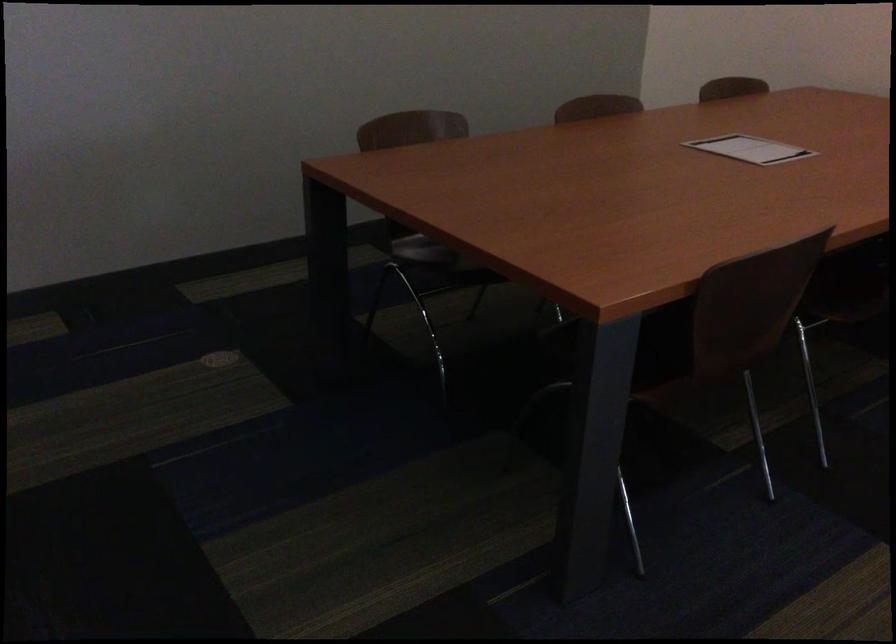
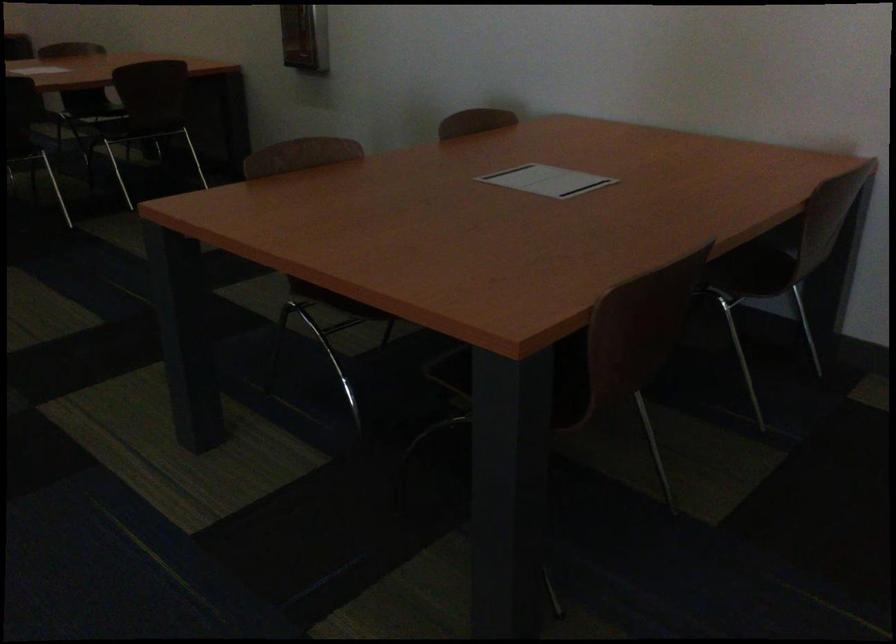
How did the camera likely rotate?

The rotation direction of the camera is left-down.